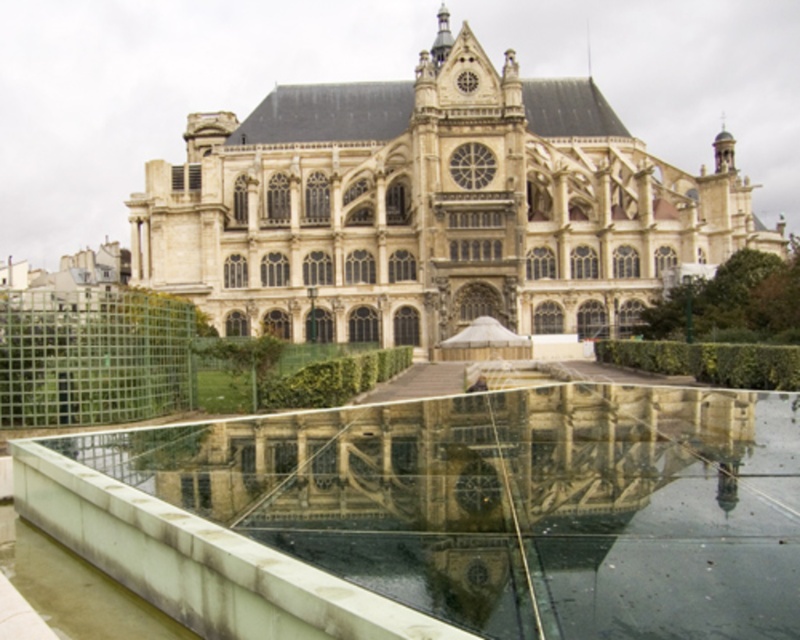
Question: Which of the following is the farthest from the observer?

Choices:
 (A) beige stone church at center
 (B) clear glass pool at center

Answer: (A)

Question: Does clear glass pool at center have a larger size compared to beige stone church at center?

Choices:
 (A) yes
 (B) no

Answer: (B)

Question: Among these points, which one is farthest from the camera?

Choices:
 (A) (678, 250)
 (B) (358, 580)

Answer: (A)

Question: In this image, where is clear glass pool at center located relative to beige stone church at center?

Choices:
 (A) right
 (B) left

Answer: (B)

Question: Is clear glass pool at center wider than beige stone church at center?

Choices:
 (A) yes
 (B) no

Answer: (B)